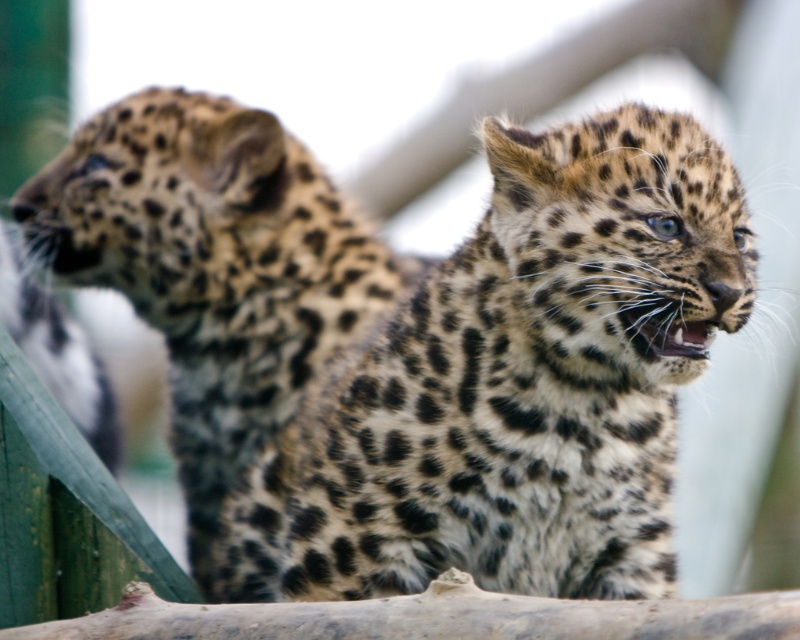
Question: Can you confirm if spotted fur cheetah at center is positioned to the right of spotted fur cheetah at left?

Choices:
 (A) no
 (B) yes

Answer: (B)

Question: Which point is farther to the camera?

Choices:
 (A) spotted fur cheetah at center
 (B) spotted fur cheetah at left

Answer: (B)

Question: Among these points, which one is nearest to the camera?

Choices:
 (A) (289, 246)
 (B) (516, 304)

Answer: (B)

Question: Is spotted fur cheetah at center bigger than spotted fur cheetah at left?

Choices:
 (A) yes
 (B) no

Answer: (A)

Question: Does spotted fur cheetah at center appear under spotted fur cheetah at left?

Choices:
 (A) no
 (B) yes

Answer: (B)

Question: Which point is farther to the camera?

Choices:
 (A) (320, 435)
 (B) (70, 176)

Answer: (B)